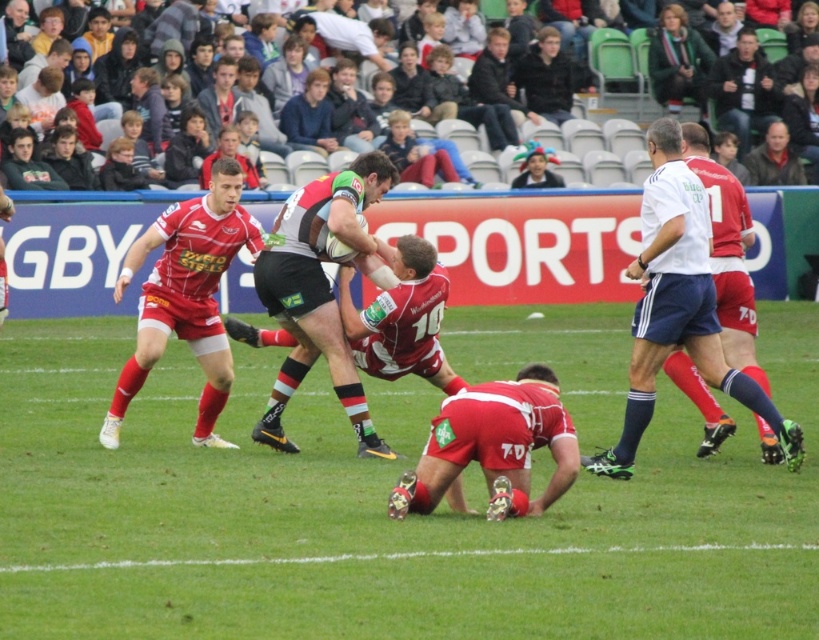
Is point (629, 484) positioned behind point (749, 52)?

No.

This screenshot has width=819, height=640. Describe the element at coordinates (378, 515) in the screenshot. I see `green grass at center` at that location.

The image size is (819, 640). I want to click on green grass at center, so click(x=378, y=515).

Consider the image. Measure the distance from green grass at center to multicolored fabric hat at upper center.

A distance of 8.26 meters exists between green grass at center and multicolored fabric hat at upper center.

Which is behind, point (267, 588) or point (545, 157)?

The point (545, 157) is more distant.

At what (x,y) coordinates should I click in order to perform the action: click on green grass at center. Please return your answer as a coordinate pair (x, y). Looking at the image, I should click on (378, 515).

Who is more distant from viewer, (210, 166) or (551, 180)?

The point (551, 180) is more distant.

Between matte red rugby player at center and multicolored fabric hat at upper center, which one is positioned higher?

Positioned higher is multicolored fabric hat at upper center.

Who is more forward, (252, 188) or (544, 161)?

Point (252, 188)

This screenshot has width=819, height=640. What are the coordinates of `matte red rugby player at center` in the screenshot? It's located at (229, 157).